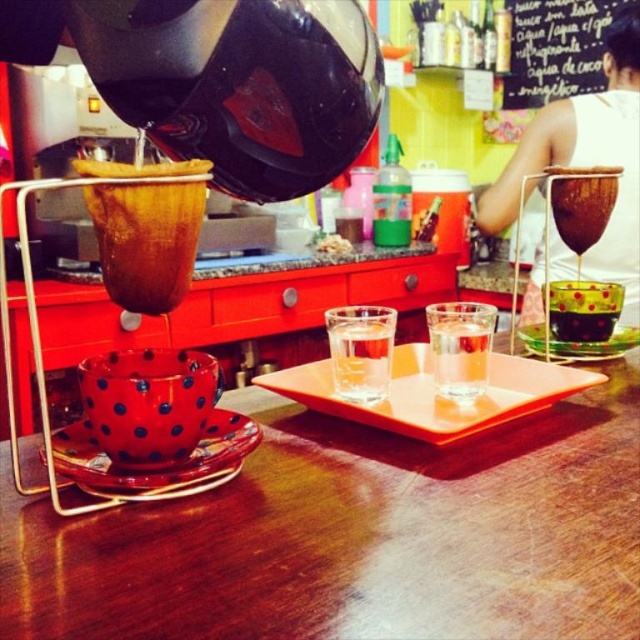
You are a customer sitting at the table in the coffee shop. You want to grab the translucent glass cup at center to take a sip. Based on its 2D location coordinates, where should you reach to pick it up?

The translucent glass cup at center is located at the 2D coordinates point [582,308], so you should reach towards that point to pick it up.

You are a barista who needs to place a 1.5 inch wide coaster between the translucent glass cup at center and the polka dot glass at center. Is there enough space between them to fit the coaster?

The translucent glass cup at center and polka dot glass at center are 1.51 inches apart, so yes, the coaster can fit between them as the space is slightly larger than the coaster.